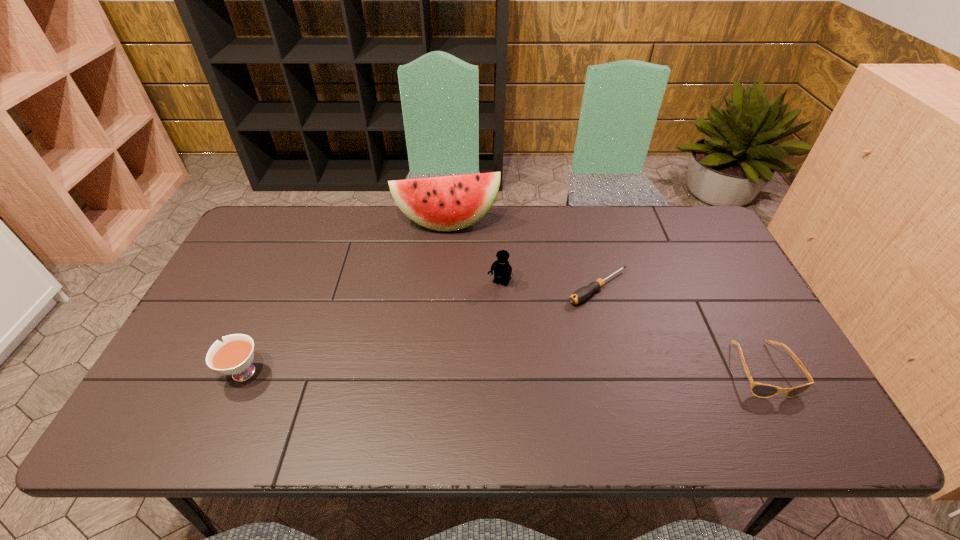
Identify the location of the leftmost object. (234, 357).

Where is `the third tallest object`? The width and height of the screenshot is (960, 540). the third tallest object is located at coordinates (234, 357).

The width and height of the screenshot is (960, 540). In order to click on the rightmost object in this screenshot , I will do `click(761, 390)`.

You are a GUI agent. You are given a task and a screenshot of the screen. Output one action in this format:
    pyautogui.click(x=<x>, y=<y>)
    Task: Click on the sunglasses
    Image resolution: width=960 pixels, height=540 pixels.
    Given the screenshot: What is the action you would take?
    pyautogui.click(x=761, y=390)

Identify the location of Lego. (502, 270).

Locate an element on the screen. the second object from right to left is located at coordinates (580, 295).

Locate an element on the screen. This screenshot has width=960, height=540. screwdriver is located at coordinates (580, 295).

The image size is (960, 540). I want to click on the farthest object, so click(x=448, y=203).

Image resolution: width=960 pixels, height=540 pixels. I want to click on the tallest object, so click(448, 203).

I want to click on free space located 0.080m on the side of the leftmost object with the handle, so click(x=184, y=373).